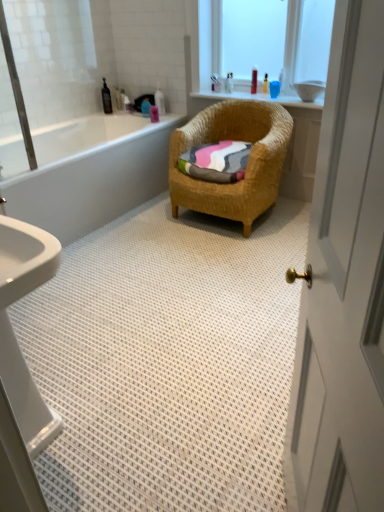
Question: Does black plastic bottle at upper left, placed as the 1th toiletry when sorted from left to right, have a larger size compared to white glossy door at right?

Choices:
 (A) yes
 (B) no

Answer: (B)

Question: From the image's perspective, is black plastic bottle at upper left, positioned as the seventh toiletry in right-to-left order, on white glossy door at right?

Choices:
 (A) no
 (B) yes

Answer: (B)

Question: Does black plastic bottle at upper left, positioned as the seventh toiletry in right-to-left order, appear on the right side of white glossy door at right?

Choices:
 (A) no
 (B) yes

Answer: (A)

Question: Considering the relative sizes of black plastic bottle at upper left, placed as the 1th toiletry when sorted from left to right, and white glossy door at right in the image provided, is black plastic bottle at upper left, placed as the 1th toiletry when sorted from left to right, smaller than white glossy door at right?

Choices:
 (A) no
 (B) yes

Answer: (B)

Question: Can you confirm if black plastic bottle at upper left, placed as the 1th toiletry when sorted from left to right, is positioned to the left of white glossy door at right?

Choices:
 (A) yes
 (B) no

Answer: (A)

Question: From a real-world perspective, is white glossy bottle at upper center, arranged as the fourth toiletry when viewed from the left, positioned above or below translucent plastic bottle at upper center, which is the 7th toiletry from left to right?

Choices:
 (A) below
 (B) above

Answer: (A)

Question: From the image's perspective, is white glossy bottle at upper center, which appears as the fourth toiletry when viewed from the right, above or below translucent plastic bottle at upper center, the first toiletry positioned from the right?

Choices:
 (A) below
 (B) above

Answer: (A)

Question: Is white glossy bottle at upper center, arranged as the fourth toiletry when viewed from the left, in front of or behind translucent plastic bottle at upper center, the first toiletry positioned from the right, in the image?

Choices:
 (A) front
 (B) behind

Answer: (B)

Question: Looking at their shapes, would you say white glossy bottle at upper center, arranged as the fourth toiletry when viewed from the left, is wider or thinner than translucent plastic bottle at upper center, which is the 7th toiletry from left to right?

Choices:
 (A) wide
 (B) thin

Answer: (A)

Question: Looking at the image, does white glossy bathtub at left seem bigger or smaller compared to translucent plastic bottle at upper center, which is the 7th toiletry from left to right?

Choices:
 (A) big
 (B) small

Answer: (A)

Question: Considering their positions, is white glossy bathtub at left located in front of or behind translucent plastic bottle at upper center, the first toiletry positioned from the right?

Choices:
 (A) behind
 (B) front

Answer: (B)

Question: From a real-world perspective, is white glossy bathtub at left physically located above or below translucent plastic bottle at upper center, the first toiletry positioned from the right?

Choices:
 (A) above
 (B) below

Answer: (B)

Question: In terms of height, does white glossy bathtub at left look taller or shorter compared to translucent plastic bottle at upper center, the first toiletry positioned from the right?

Choices:
 (A) tall
 (B) short

Answer: (A)

Question: Is pink matte bottle at upper center, the 5th toiletry viewed from the right, to the left or to the right of translucent plastic bottle at upper center, marked as the third toiletry in a right-to-left arrangement, in the image?

Choices:
 (A) left
 (B) right

Answer: (A)

Question: Would you say pink matte bottle at upper center, the 3th toiletry viewed from the left, is inside or outside translucent plastic bottle at upper center, which is the 5th toiletry from left to right?

Choices:
 (A) inside
 (B) outside

Answer: (B)